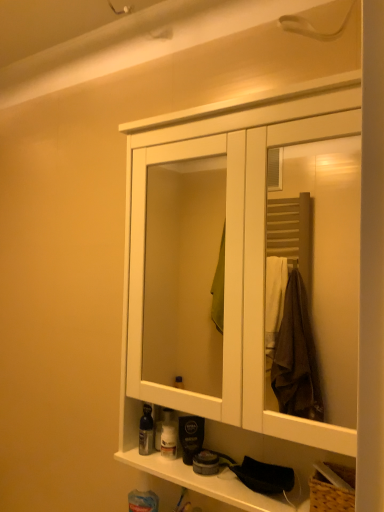
Question: From the image's perspective, is translucent plastic bottle at lower center, which is counted as the 1th toiletry, starting from the right, located above or below shiny silver bottle at lower left, acting as the 2th toiletry starting from the right?

Choices:
 (A) above
 (B) below

Answer: (B)

Question: Is translucent plastic bottle at lower center, which is counted as the 1th toiletry, starting from the right, taller or shorter than shiny silver bottle at lower left, acting as the 2th toiletry starting from the right?

Choices:
 (A) short
 (B) tall

Answer: (B)

Question: Which is farther from the shiny silver bottle at lower left, acting as the 2th toiletry starting from the right?

Choices:
 (A) translucent plastic bottle at lower center, which is counted as the 1th toiletry, starting from the right
 (B) white wood cabinet at center

Answer: (B)

Question: Which object is positioned closest to the translucent plastic bottle at lower center, the 2th toiletry from the left?

Choices:
 (A) white wood cabinet at center
 (B) shiny silver bottle at lower left, positioned as the first toiletry in left-to-right order

Answer: (B)